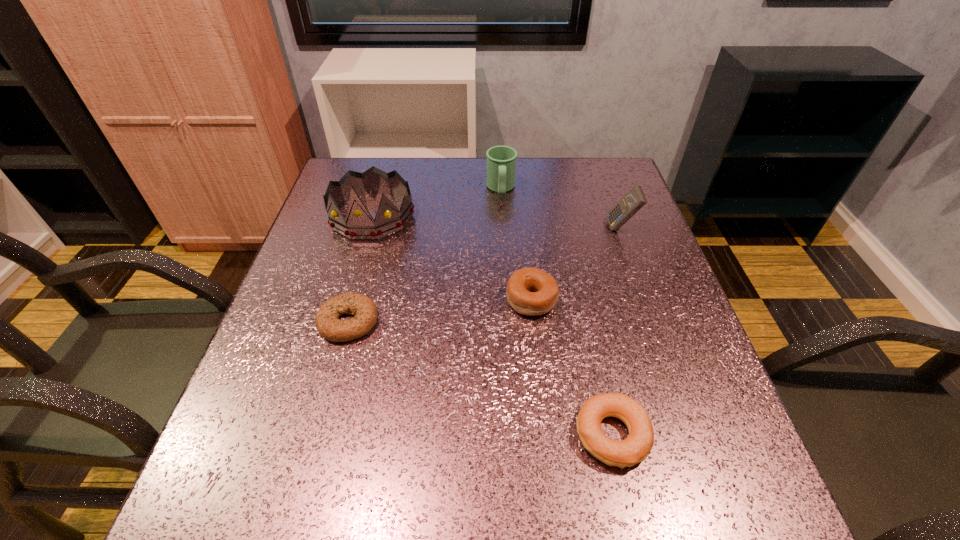
Locate an element on the screen. The height and width of the screenshot is (540, 960). free space located 0.090m on the side of the mug with the handle is located at coordinates (503, 223).

The height and width of the screenshot is (540, 960). I want to click on blank area located 0.380m on the left of the fourth tallest object, so click(327, 299).

This screenshot has width=960, height=540. What are the coordinates of `free space located on the right of the nearest bagel` in the screenshot? It's located at pos(709,435).

The width and height of the screenshot is (960, 540). Find the location of `free spot located on the front of the leftmost bagel`. free spot located on the front of the leftmost bagel is located at coordinates (335, 372).

Where is `tiara at the far edge`? Image resolution: width=960 pixels, height=540 pixels. tiara at the far edge is located at coordinates (359, 225).

This screenshot has height=540, width=960. Identify the location of mug that is at the far edge. (501, 160).

Identify the location of tiara that is at the left edge. (359, 225).

Identify the location of bagel that is at the left edge. The image size is (960, 540). (364, 310).

Where is `calculator at the right edge`? The image size is (960, 540). calculator at the right edge is located at coordinates (634, 200).

Locate an element on the screen. The image size is (960, 540). bagel located at the right edge is located at coordinates (634, 449).